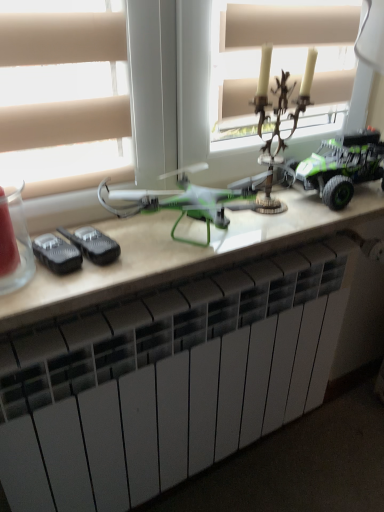
Question: From a real-world perspective, is green plastic drone at center physically below green matte toy truck at right, marked as the 2th toy in a left-to-right arrangement?

Choices:
 (A) yes
 (B) no

Answer: (A)

Question: Does green plastic drone at center have a larger size compared to green matte toy truck at right, marked as the 2th toy in a left-to-right arrangement?

Choices:
 (A) no
 (B) yes

Answer: (B)

Question: From the image's perspective, is green plastic drone at center located beneath green matte toy truck at right, the 1th toy viewed from the right?

Choices:
 (A) yes
 (B) no

Answer: (A)

Question: Is green plastic drone at center far from green matte toy truck at right, marked as the 2th toy in a left-to-right arrangement?

Choices:
 (A) no
 (B) yes

Answer: (A)

Question: Is green plastic drone at center at the right side of green matte toy truck at right, the 1th toy viewed from the right?

Choices:
 (A) no
 (B) yes

Answer: (A)

Question: From the image's perspective, is green plastic drone at center located above or below green matte toy truck at right, the 1th toy viewed from the right?

Choices:
 (A) above
 (B) below

Answer: (B)

Question: Is green plastic drone at center spatially inside green matte toy truck at right, marked as the 2th toy in a left-to-right arrangement, or outside of it?

Choices:
 (A) inside
 (B) outside

Answer: (B)

Question: From a real-world perspective, relative to green matte toy truck at right, marked as the 2th toy in a left-to-right arrangement, is green plastic drone at center vertically above or below?

Choices:
 (A) below
 (B) above

Answer: (A)

Question: Does point (175, 264) appear closer or farther from the camera than point (288, 174)?

Choices:
 (A) farther
 (B) closer

Answer: (B)

Question: Choose the correct answer: Is antique bronze candlestick at upper center, the 2th toy positioned from the right, inside green matte toy truck at right, marked as the 2th toy in a left-to-right arrangement, or outside it?

Choices:
 (A) inside
 (B) outside

Answer: (B)

Question: In terms of height, does antique bronze candlestick at upper center, the 2th toy positioned from the right, look taller or shorter compared to green matte toy truck at right, marked as the 2th toy in a left-to-right arrangement?

Choices:
 (A) tall
 (B) short

Answer: (A)

Question: Is point (271, 180) positioned closer to the camera than point (304, 166)?

Choices:
 (A) closer
 (B) farther

Answer: (A)

Question: Visually, is antique bronze candlestick at upper center, the 2th toy positioned from the right, positioned to the left or to the right of green matte toy truck at right, marked as the 2th toy in a left-to-right arrangement?

Choices:
 (A) right
 (B) left

Answer: (B)

Question: Based on their positions, is antique bronze candlestick at upper center, which is the first toy in left-to-right order, located to the left or right of green plastic drone at center?

Choices:
 (A) left
 (B) right

Answer: (B)

Question: Is point (276, 116) positioned closer to the camera than point (369, 215)?

Choices:
 (A) farther
 (B) closer

Answer: (B)